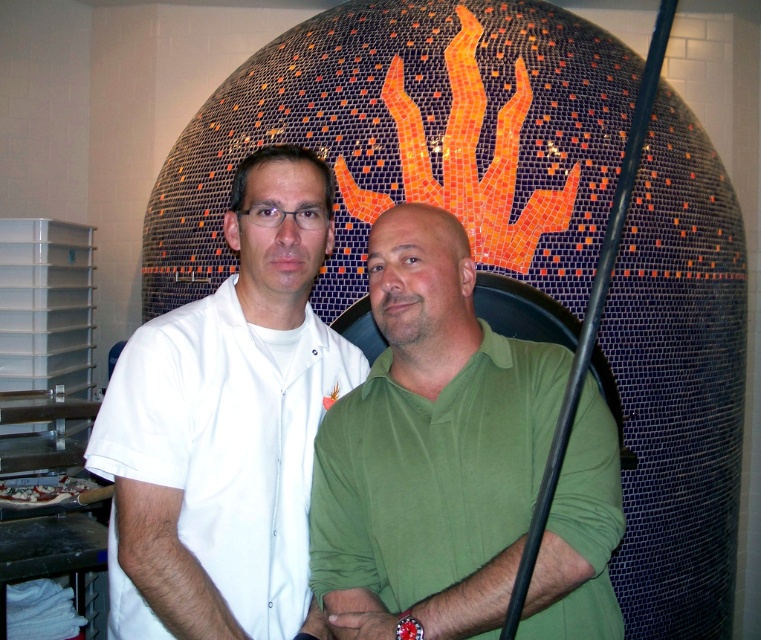
Consider the image. Does white smooth shirt at center have a larger size compared to white glossy pizza at lower left?

Indeed, white smooth shirt at center has a larger size compared to white glossy pizza at lower left.

Between point (190, 472) and point (24, 499), which one is positioned in front?

Positioned in front is point (190, 472).

This screenshot has width=761, height=640. Find the location of `white smooth shirt at center`. white smooth shirt at center is located at coordinates (225, 426).

How far apart are green matte shirt at center and white smooth shirt at center?

The distance of green matte shirt at center from white smooth shirt at center is 30.63 centimeters.

Does green matte shirt at center have a larger size compared to white smooth shirt at center?

Incorrect, green matte shirt at center is not larger than white smooth shirt at center.

Locate an element on the screen. The height and width of the screenshot is (640, 761). green matte shirt at center is located at coordinates (428, 448).

Is green matte shirt at center in front of white glossy pizza at lower left?

Yes, green matte shirt at center is in front of white glossy pizza at lower left.

This screenshot has height=640, width=761. What are the coordinates of `green matte shirt at center` in the screenshot? It's located at (428, 448).

Does point (422, 326) lie behind point (56, 496)?

No, it is in front of (56, 496).

Find the location of a particular element. This screenshot has height=640, width=761. green matte shirt at center is located at coordinates (428, 448).